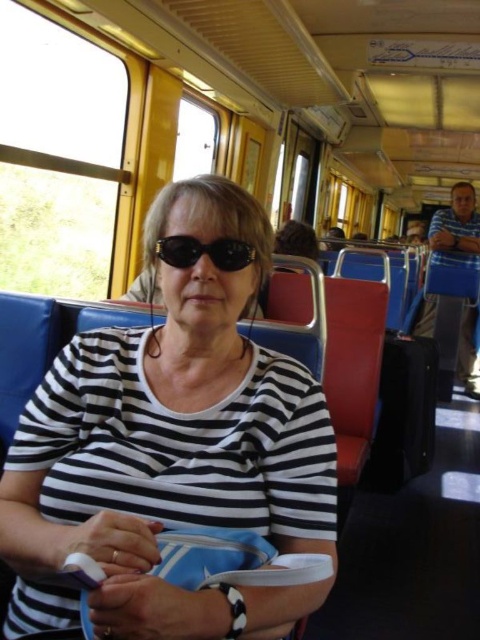
You are a train conductor who needs to check the ticket of the person wearing the black striped shirt at center. The minimum distance required between you and the passenger for the ticket scanner to work is 22 inches. Can you scan their ticket from your current position?

The distance between you and the black striped shirt at center is 22.68 inches, which is slightly more than the minimum required 22 inches. Therefore, you can scan their ticket from your current position.

You are a passenger on the train and need to place your black rubber goggles at center on the blue fabric coach at right. Will the goggles fit on the coach without overlapping the edges?

The blue fabric coach at right is wider than the black rubber goggles at center, so the goggles will fit without overlapping the edges.

You are standing at the point marked as point (x=37, y=392) in the train carriage. You need to take a photo of the entire carriage from this position. The camera you have can only focus on objects within 35 inches. Will the camera be able to capture the entire carriage in one shot?

The distance between point (x=37, y=392) and the camera is 35.88 inches. Since the camera can only focus on objects within 35 inches, the camera will not be able to capture the entire carriage in one shot because the distance exceeds the focus range.